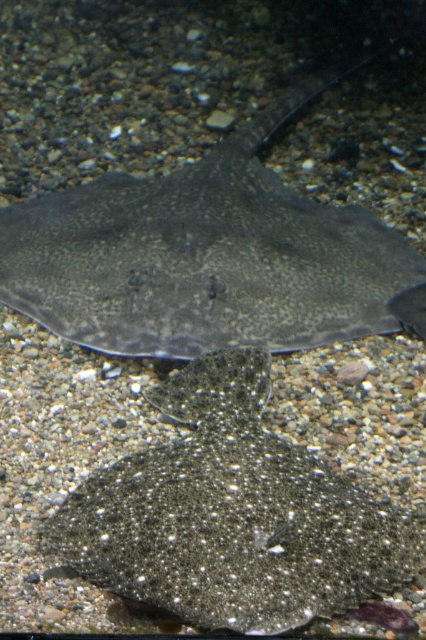
Question: Can you confirm if dark gray textured stingray at center is positioned above speckled matte flatfish at center?

Choices:
 (A) yes
 (B) no

Answer: (A)

Question: Among these objects, which one is nearest to the camera?

Choices:
 (A) dark gray textured stingray at center
 (B) speckled matte flatfish at center

Answer: (B)

Question: Is dark gray textured stingray at center above speckled matte flatfish at center?

Choices:
 (A) no
 (B) yes

Answer: (B)

Question: Which point appears closest to the camera in this image?

Choices:
 (A) tap(163, 561)
 (B) tap(112, 218)

Answer: (A)

Question: Can you confirm if dark gray textured stingray at center is smaller than speckled matte flatfish at center?

Choices:
 (A) no
 (B) yes

Answer: (A)